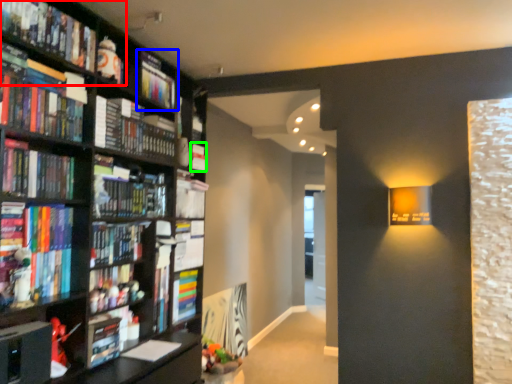
Question: Which is farther away from book (highlighted by a red box)? book (highlighted by a blue box) or book (highlighted by a green box)?

Choices:
 (A) book
 (B) book

Answer: (B)